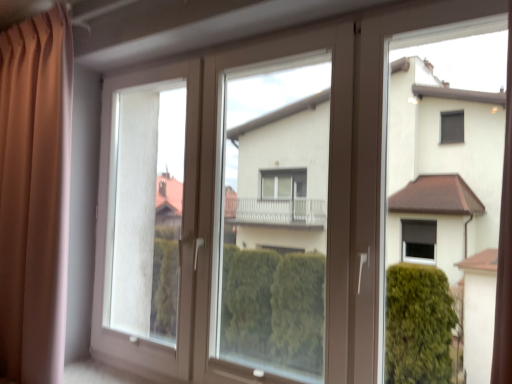
The image size is (512, 384). What do you see at coordinates (228, 216) in the screenshot? I see `transparent plastic glass door at center` at bounding box center [228, 216].

This screenshot has width=512, height=384. Find the location of `transparent plastic glass door at center`. transparent plastic glass door at center is located at coordinates (228, 216).

Find the location of a particular element. The height and width of the screenshot is (384, 512). transparent plastic glass door at center is located at coordinates (228, 216).